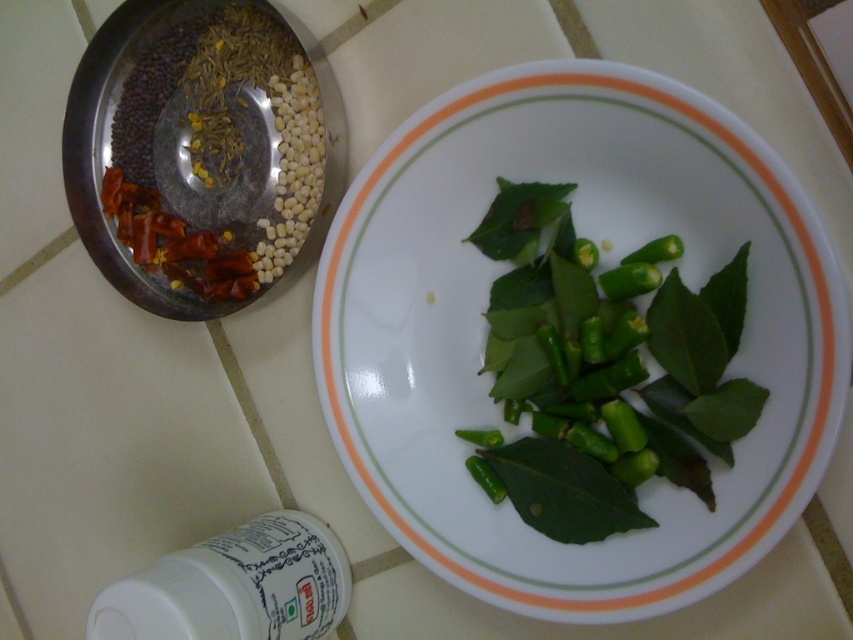
You have a white glossy plate at center that you want to move to the edge of the table. The edge is 20 inches away from the plate. Can you move the plate to the edge without moving it past the edge?

The distance between the white glossy plate at center and the edge is 19.49 inches, which is less than 20 inches. Therefore, you can move the plate to the edge without moving it past.

You are setting the table for a meal and need to place a decorative centerpiece. The white glossy plate at center and the metallic bowl at upper left are both on the table. Where should you place the centerpiece so it is between them?

The white glossy plate at center is to the right of the metallic bowl at upper left, so placing the centerpiece between them would require positioning it to the right of the metallic bowl at upper left and to the left of the white glossy plate at center.

In the scene shown: You are setting up a dinner table and need to place a decorative centerpiece on the white glossy plate at center. However, you also have a metallic bowl at upper left that needs to be placed nearby. Considering their sizes, which object has a larger width and can accommodate the centerpiece better?

The white glossy plate at center has a larger width than the metallic bowl at upper left, so it can accommodate the centerpiece better.